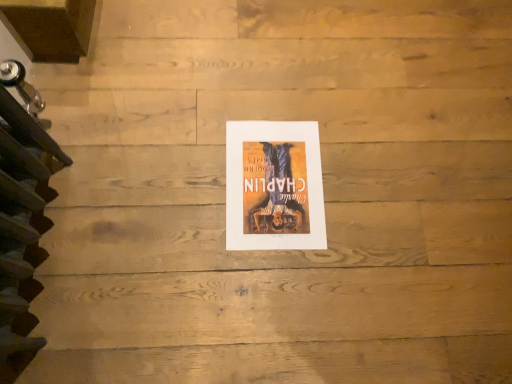
Where is `free space above matte paper poster at center (from a real-world perspective)`? This screenshot has height=384, width=512. free space above matte paper poster at center (from a real-world perspective) is located at coordinates (272, 177).